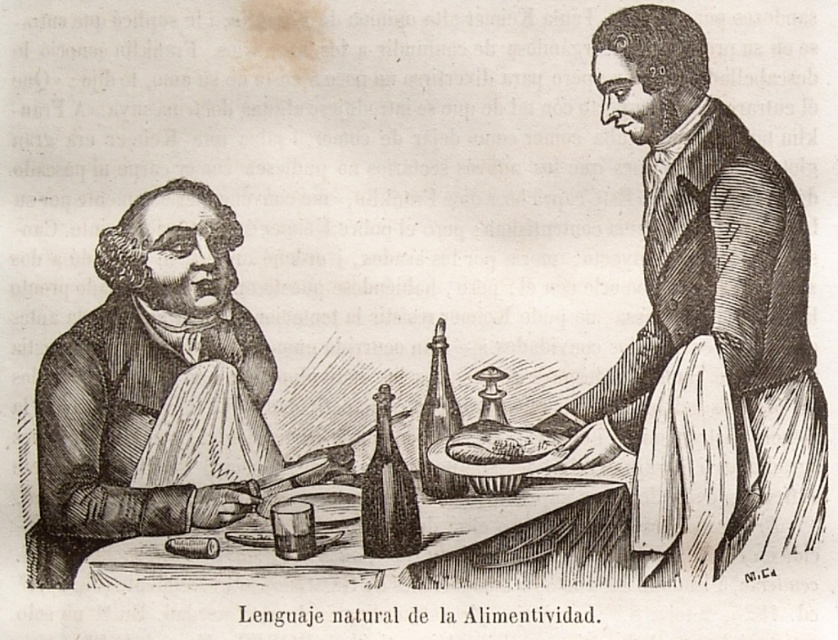
Question: Estimate the real-world distances between objects in this image. Which object is farther from the translucent glass bottle at center?

Choices:
 (A) smooth paper napkin at left
 (B) smooth wood table at center

Answer: (A)

Question: Can you confirm if smooth black coat at right is wider than smooth wood table at center?

Choices:
 (A) yes
 (B) no

Answer: (B)

Question: Can you confirm if smooth paper napkin at left is smaller than translucent glass bottle at center?

Choices:
 (A) yes
 (B) no

Answer: (B)

Question: Which of the following is the closest to the observer?

Choices:
 (A) smooth black coat at right
 (B) translucent glass bottle at center

Answer: (A)

Question: Does smooth black coat at right lie in front of smooth brown bread at center?

Choices:
 (A) yes
 (B) no

Answer: (B)

Question: Based on their relative distances, which object is nearer to the smooth glass bottle at center?

Choices:
 (A) smooth paper napkin at left
 (B) smooth brown bread at center
 (C) translucent glass bottle at center

Answer: (B)